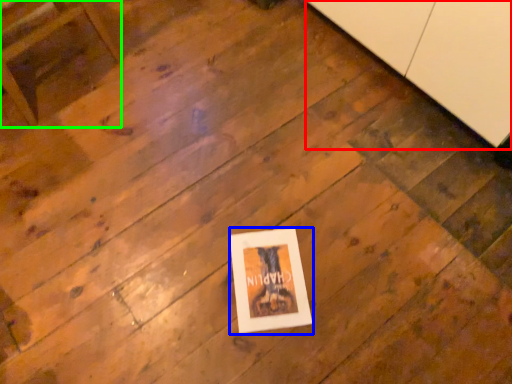
Question: Estimate the real-world distances between objects in this image. Which object is closer to cabinetry (highlighted by a red box), picture frame (highlighted by a blue box) or furniture (highlighted by a green box)?

Choices:
 (A) picture frame
 (B) furniture

Answer: (A)